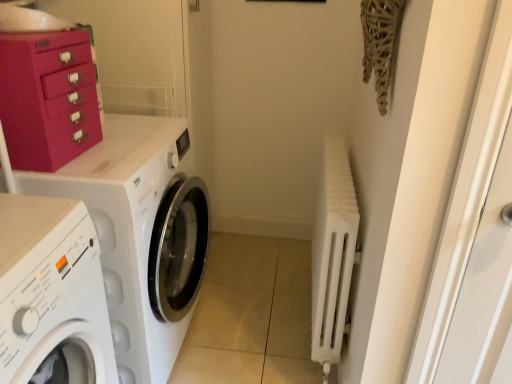
Question: Can you confirm if white matte washing machine at left, the 2th washing machine viewed from the back, is wider than white matte radiator at right?

Choices:
 (A) no
 (B) yes

Answer: (B)

Question: Is white matte washing machine at left, the 2th washing machine viewed from the back, surrounding white matte radiator at right?

Choices:
 (A) yes
 (B) no

Answer: (B)

Question: Is white matte washing machine at left, which is the 1th washing machine in front-to-back order, behind white matte radiator at right?

Choices:
 (A) yes
 (B) no

Answer: (B)

Question: Does white matte washing machine at left, which is the 1th washing machine in front-to-back order, have a lesser width compared to white matte radiator at right?

Choices:
 (A) no
 (B) yes

Answer: (A)

Question: Considering the relative sizes of white matte washing machine at left, which is the 1th washing machine in front-to-back order, and white matte radiator at right in the image provided, is white matte washing machine at left, which is the 1th washing machine in front-to-back order, bigger than white matte radiator at right?

Choices:
 (A) yes
 (B) no

Answer: (A)

Question: Considering the relative positions of white matte washing machine at left, the 2th washing machine viewed from the back, and white matte radiator at right in the image provided, is white matte washing machine at left, the 2th washing machine viewed from the back, to the right of white matte radiator at right from the viewer's perspective?

Choices:
 (A) no
 (B) yes

Answer: (A)

Question: Is the depth of white matte radiator at right greater than that of white glossy washing machine at left, the 1th washing machine from the back?

Choices:
 (A) yes
 (B) no

Answer: (A)

Question: Can you confirm if white matte radiator at right is shorter than white glossy washing machine at left, the 1th washing machine from the back?

Choices:
 (A) yes
 (B) no

Answer: (A)

Question: Considering the relative sizes of white matte radiator at right and white glossy washing machine at left, the 1th washing machine from the back, in the image provided, is white matte radiator at right wider than white glossy washing machine at left, the 1th washing machine from the back,?

Choices:
 (A) yes
 (B) no

Answer: (B)

Question: From a real-world perspective, does white matte radiator at right stand above white glossy washing machine at left, the 1th washing machine from the back?

Choices:
 (A) yes
 (B) no

Answer: (B)

Question: Is white matte radiator at right to the right of white glossy washing machine at left, the 1th washing machine from the back, from the viewer's perspective?

Choices:
 (A) no
 (B) yes

Answer: (B)

Question: Is white matte radiator at right smaller than white glossy washing machine at left, acting as the 2th washing machine starting from the front?

Choices:
 (A) no
 (B) yes

Answer: (B)

Question: Is white glossy washing machine at left, acting as the 2th washing machine starting from the front, smaller than white matte washing machine at left, which is the 1th washing machine in front-to-back order?

Choices:
 (A) yes
 (B) no

Answer: (B)